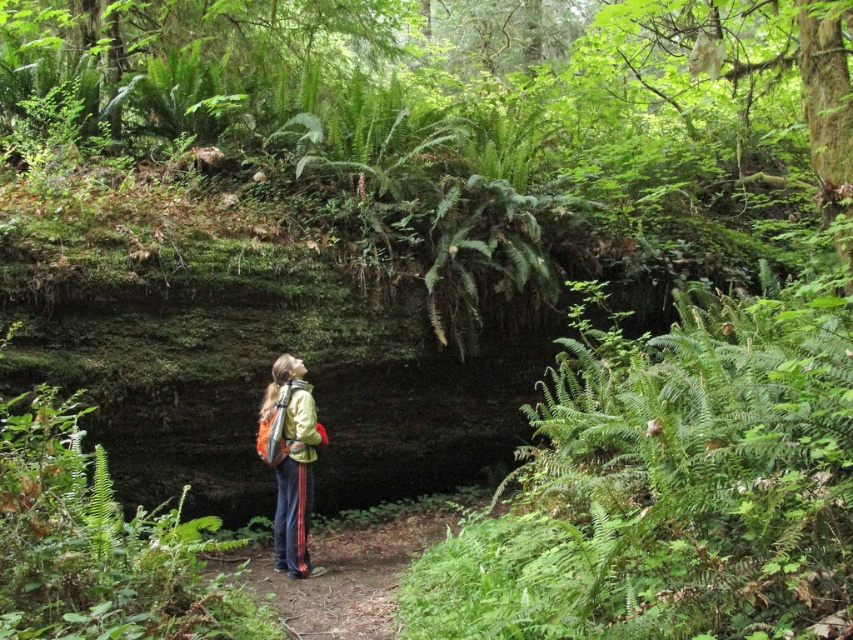
You are a hiker trying to decide whether to walk along the brown dirt trail at center while carrying the green matte jacket at center. Can you fit comfortably on the trail?

A: The brown dirt trail at center might be wider than green matte jacket at center, so it is possible that you can fit comfortably, but there is uncertainty due to the comparative width not being definitively confirmed.

You are a hiker who wants to take a photo of the brown dirt trail at center and the green matte jacket at center. Which object should you focus on first if you want to capture both in one frame without moving the camera?

The brown dirt trail at center is bigger than the green matte jacket at center, so you should focus on the larger brown dirt trail at center first to ensure it fills the frame appropriately before adjusting for the smaller jacket.

You are a hiker who wants to follow the brown dirt trail at center to reach a campsite. However, you notice the green matte jacket at center in your path. Can you walk around the jacket without stepping on it?

The brown dirt trail at center is below green matte jacket at center, so the jacket is blocking the path. You can walk around it by stepping to the side of the trail where the jacket isn not covering.